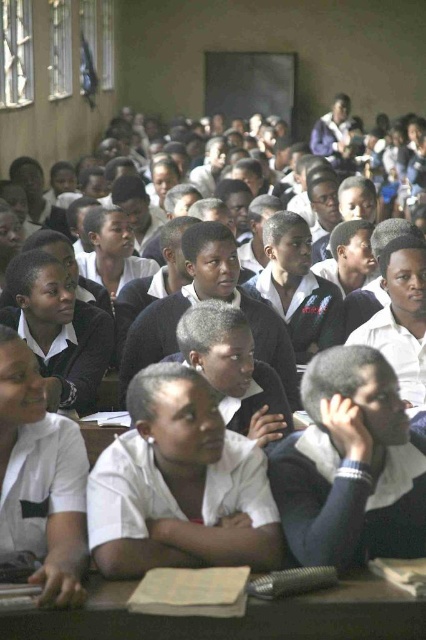
Does white matte shirt at center lie in front of wooden desk at center?

No, it is not.

Can you confirm if white matte shirt at center is positioned to the right of wooden desk at center?

Incorrect, white matte shirt at center is not on the right side of wooden desk at center.

Locate an element on the screen. This screenshot has height=640, width=426. white matte shirt at center is located at coordinates (178, 484).